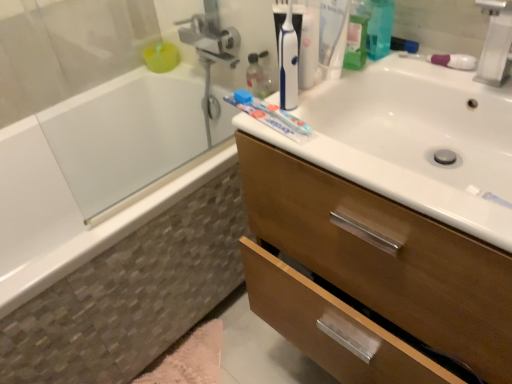
The image size is (512, 384). Identify the location of free spot behind white plastic faucet at upper right. (425, 67).